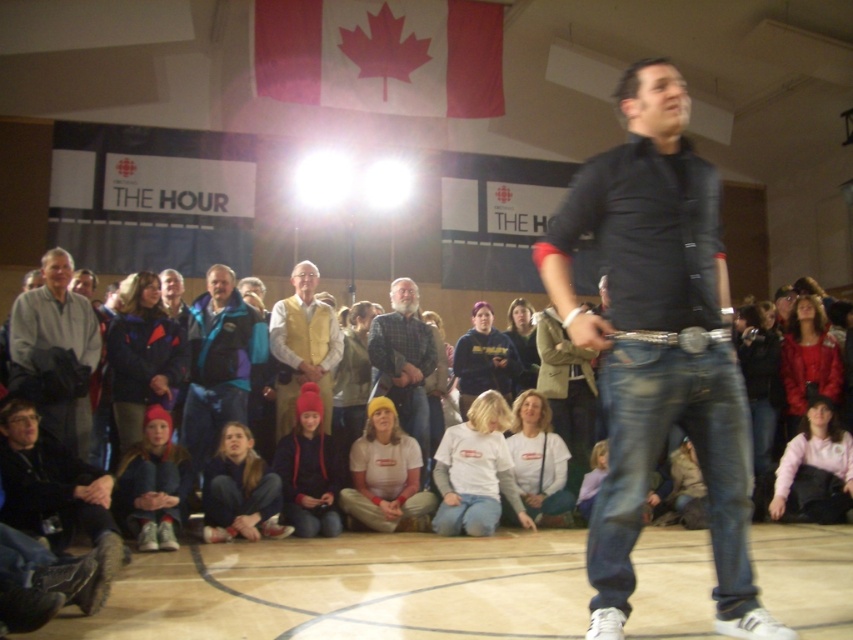
Question: Is light gray fabric jacket at left in front of red knit hat at lower center?

Choices:
 (A) yes
 (B) no

Answer: (A)

Question: Which of the following is the closest to the observer?

Choices:
 (A) red knit hat at lower left
 (B) blue fleece jacket at center
 (C) blue fleece jacket at lower left
 (D) yellow knit hat at center

Answer: (A)

Question: Does white cotton shirt at lower center come in front of yellow knit hat at center?

Choices:
 (A) yes
 (B) no

Answer: (A)

Question: Is white cotton shirt at center thinner than red fleece jacket at lower right?

Choices:
 (A) no
 (B) yes

Answer: (A)

Question: Which point is closer to the camera taking this photo?

Choices:
 (A) (364, 428)
 (B) (180, 333)

Answer: (B)

Question: Which point is closer to the camera?

Choices:
 (A) (184, 404)
 (B) (809, 396)
 (C) (444, 468)
 (D) (814, 468)

Answer: (C)